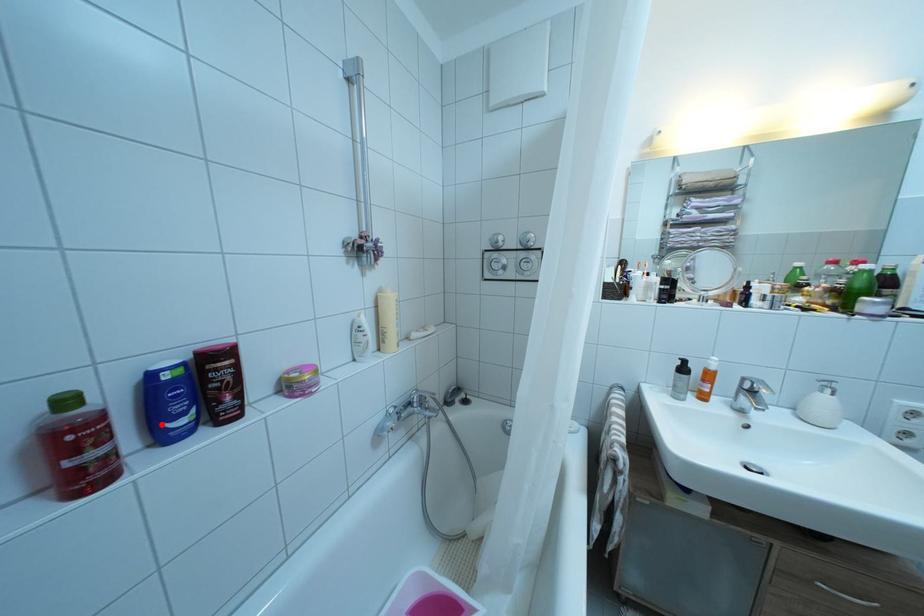
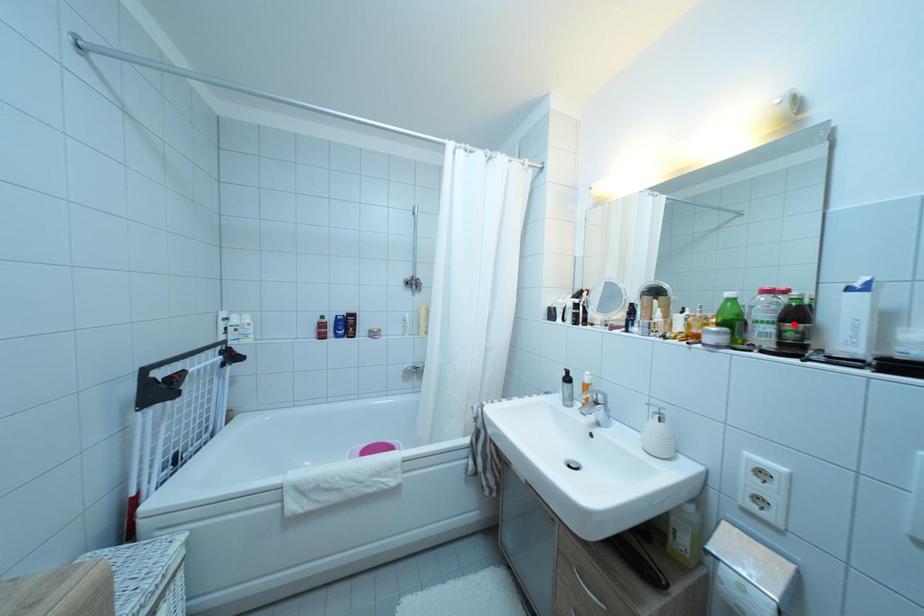
I am providing you with two images of the same scene from different viewpoints. A red point is marked on the first image and another point is marked on the second image. Is the red point in image1 aligned with the point shown in image2?

No